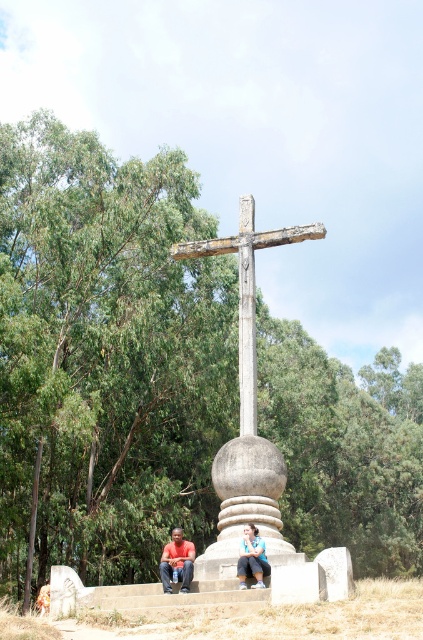
Question: Among these objects, which one is farthest from the camera?

Choices:
 (A) matte black clothing at center
 (B) matte orange shirt at lower center
 (C) weathered wood cross at center

Answer: (C)

Question: Among these points, which one is farthest from the camera?

Choices:
 (A) (264, 576)
 (B) (170, 556)
 (C) (241, 573)

Answer: (B)

Question: Is matte black clothing at center behind matte orange shirt at lower center?

Choices:
 (A) yes
 (B) no

Answer: (B)

Question: Does weathered wood cross at center have a greater width compared to matte black clothing at center?

Choices:
 (A) no
 (B) yes

Answer: (B)

Question: Considering the real-world distances, which object is closest to the weathered wood cross at center?

Choices:
 (A) blue denim jeans at lower center
 (B) matte orange shirt at lower center

Answer: (A)

Question: Can you confirm if matte orange shirt at lower center is bigger than blue denim jeans at lower center?

Choices:
 (A) no
 (B) yes

Answer: (B)